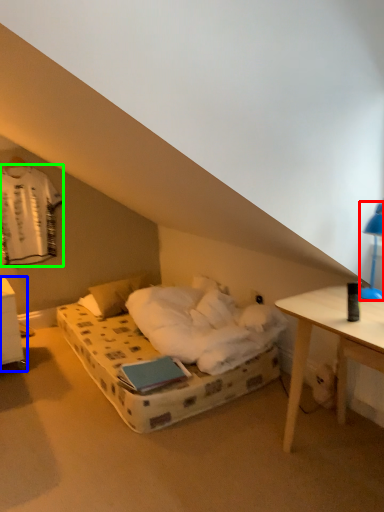
Question: Considering the real-world distances, which object is farthest from bedside lamp (highlighted by a red box)? nightstand (highlighted by a blue box) or laundry (highlighted by a green box)?

Choices:
 (A) nightstand
 (B) laundry

Answer: (B)